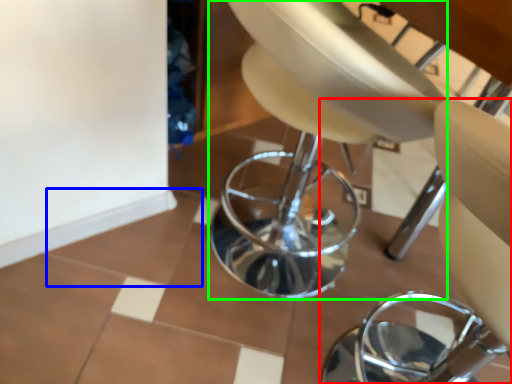
Question: Based on their relative distances, which object is nearer to chair (highlighted by a red box)? Choose from ceramic tile (highlighted by a blue box) and swivel chair (highlighted by a green box).

Choices:
 (A) ceramic tile
 (B) swivel chair

Answer: (B)